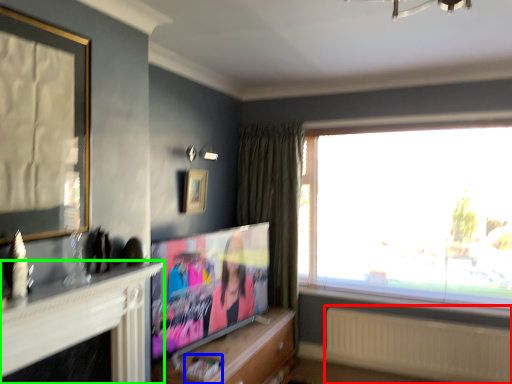
Question: Estimate the real-world distances between objects in this image. Which object is closer to radiator (highlighted by a red box), magazine (highlighted by a blue box) or fireplace (highlighted by a green box)?

Choices:
 (A) magazine
 (B) fireplace

Answer: (A)